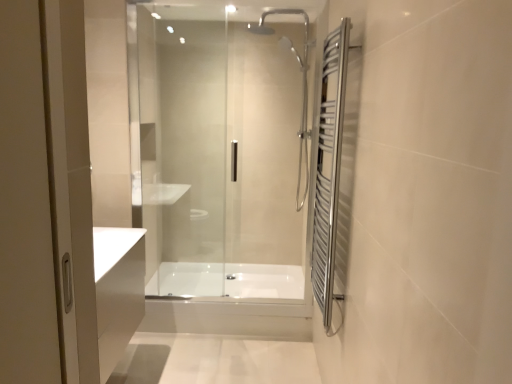
Question: Is polished chrome towel rack at right touching white glossy bathtub at center, the first bath in the front-to-back sequence?

Choices:
 (A) no
 (B) yes

Answer: (A)

Question: Could you tell me if polished chrome towel rack at right is facing white glossy bathtub at center, acting as the second bath starting from the back?

Choices:
 (A) yes
 (B) no

Answer: (B)

Question: From the image's perspective, is polished chrome towel rack at right located above white glossy bathtub at center, the first bath in the front-to-back sequence?

Choices:
 (A) no
 (B) yes

Answer: (B)

Question: Can you confirm if polished chrome towel rack at right is shorter than white glossy bathtub at center, the first bath in the front-to-back sequence?

Choices:
 (A) yes
 (B) no

Answer: (B)

Question: Would you say polished chrome towel rack at right is a long distance from white glossy bathtub at center, acting as the second bath starting from the back?

Choices:
 (A) yes
 (B) no

Answer: (B)

Question: From the image's perspective, is transparent glass shower door at center located above or below white glossy bathtub at center, which appears as the second bath when viewed from the front?

Choices:
 (A) below
 (B) above

Answer: (B)

Question: From a real-world perspective, is transparent glass shower door at center physically located above or below white glossy bathtub at center, the 1th bath viewed from the back?

Choices:
 (A) below
 (B) above

Answer: (B)

Question: Considering the positions of point (146, 61) and point (159, 288), is point (146, 61) closer or farther from the camera than point (159, 288)?

Choices:
 (A) farther
 (B) closer

Answer: (B)

Question: In terms of size, does transparent glass shower door at center appear bigger or smaller than white glossy bathtub at center, which appears as the second bath when viewed from the front?

Choices:
 (A) small
 (B) big

Answer: (B)

Question: In the image, is white glossy bathtub at center, the first bath in the front-to-back sequence, on the left side or the right side of transparent glass shower door at center?

Choices:
 (A) right
 (B) left

Answer: (B)

Question: From a real-world perspective, is white glossy bathtub at center, the first bath in the front-to-back sequence, positioned above or below transparent glass shower door at center?

Choices:
 (A) below
 (B) above

Answer: (A)

Question: Is white glossy bathtub at center, the first bath in the front-to-back sequence, inside or outside of transparent glass shower door at center?

Choices:
 (A) outside
 (B) inside

Answer: (A)

Question: In the image, is white glossy bathtub at center, acting as the second bath starting from the back, positioned in front of or behind transparent glass shower door at center?

Choices:
 (A) front
 (B) behind

Answer: (B)

Question: Choose the correct answer: Is polished chrome towel rack at right inside transparent glass shower door at center or outside it?

Choices:
 (A) inside
 (B) outside

Answer: (B)

Question: Based on their sizes in the image, would you say polished chrome towel rack at right is bigger or smaller than transparent glass shower door at center?

Choices:
 (A) big
 (B) small

Answer: (B)